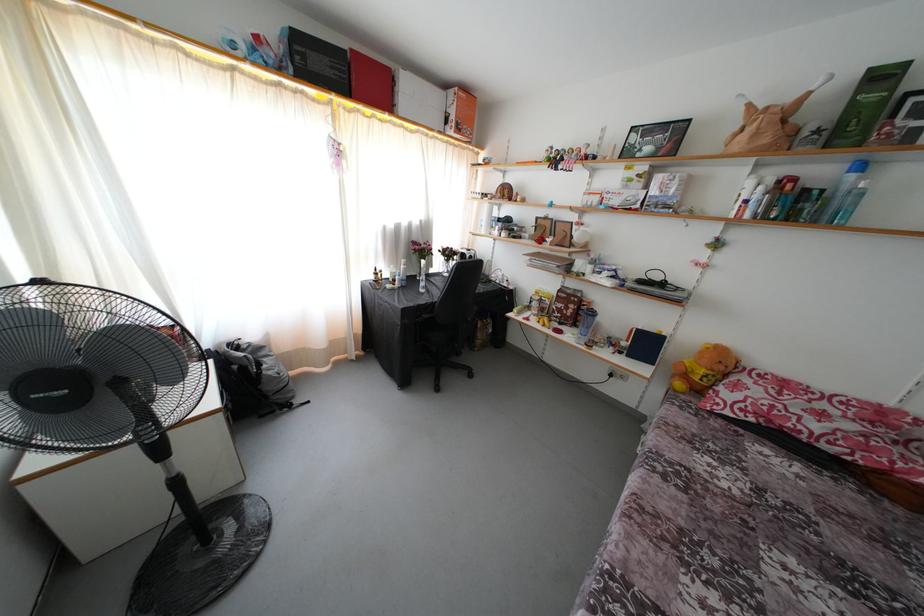
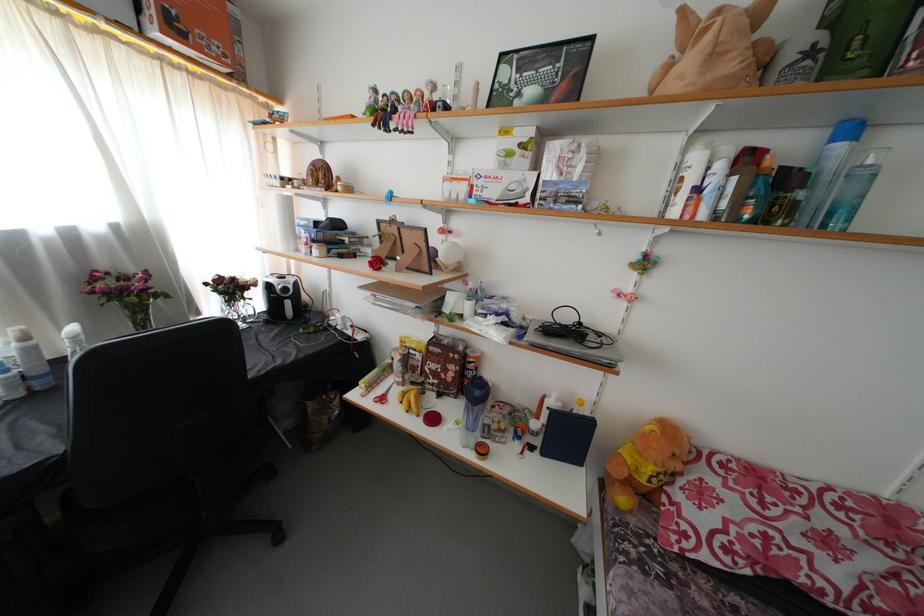
Consider the image. The images are taken continuously from a first-person perspective. In which direction are you moving?

The cameraman moved toward right, forward.